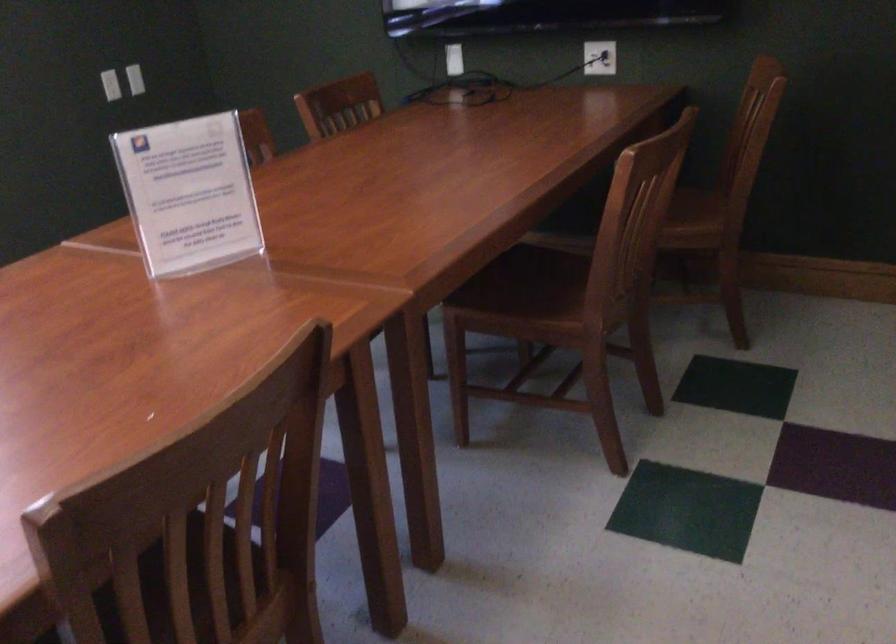
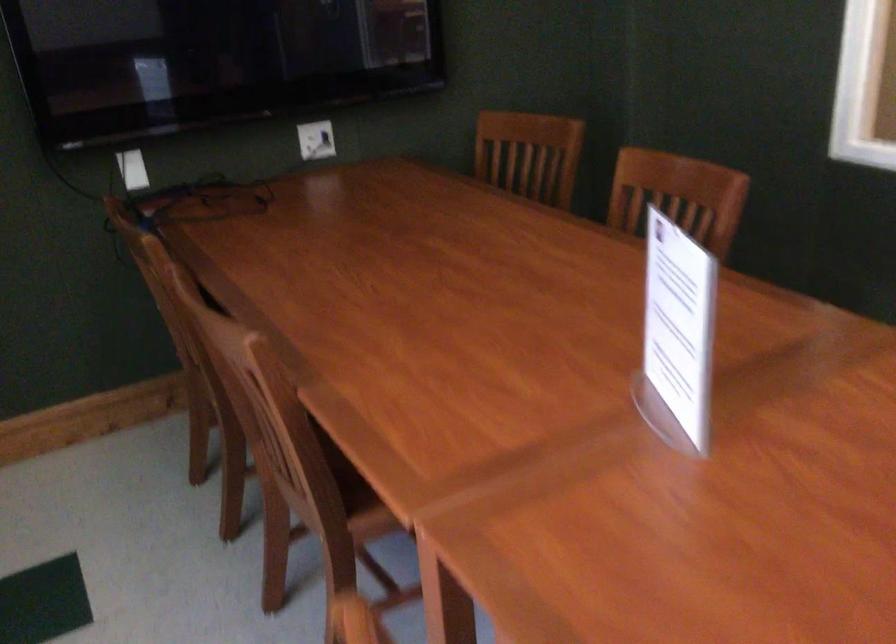
Question: I am providing you with two images of the same scene from different viewpoints. Which of the following objects are not visible in image2?

Choices:
 (A) tabletop sign holder
 (B) water filter pitcher
 (C) wooden chair sitting surface
 (D) brown chair sitting surface

Answer: (D)